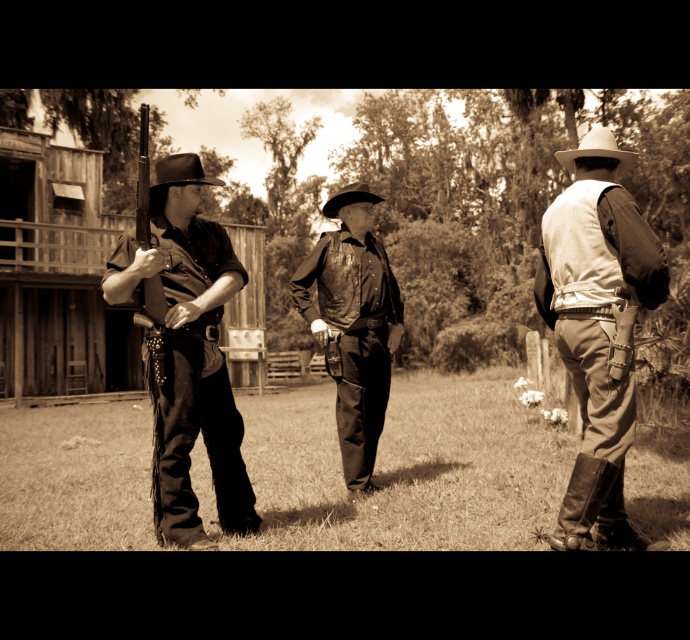
Question: Does matte black shirt at left come behind white matte cowboy hat at upper right?

Choices:
 (A) no
 (B) yes

Answer: (A)

Question: Which object is closer to the camera taking this photo?

Choices:
 (A) matte black shirt at left
 (B) white matte cowboy hat at upper right
 (C) matte black rifle at left

Answer: (C)

Question: Which point is farther to the camera?

Choices:
 (A) (580, 145)
 (B) (188, 388)
 (C) (217, 182)
 (D) (391, 342)

Answer: (D)

Question: Does leather jacket at center appear on the right side of black felt cowboy hat at left?

Choices:
 (A) yes
 (B) no

Answer: (A)

Question: Which of the following is the farthest from the observer?

Choices:
 (A) (319, 323)
 (B) (621, 168)
 (C) (328, 208)
 (D) (164, 188)

Answer: (C)

Question: Can you confirm if matte black rifle at left is positioned above black felt cowboy hat at left?

Choices:
 (A) no
 (B) yes

Answer: (A)